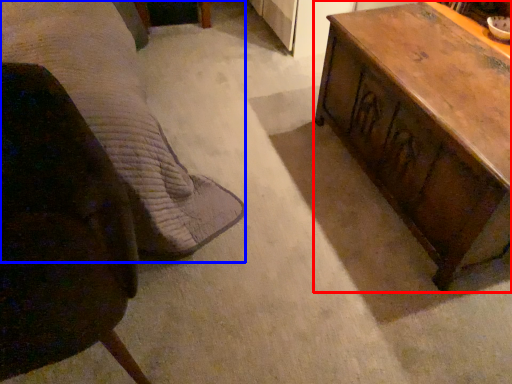
Question: Which point is further to the camera, table (highlighted by a red box) or bed (highlighted by a blue box)?

Choices:
 (A) table
 (B) bed

Answer: (A)